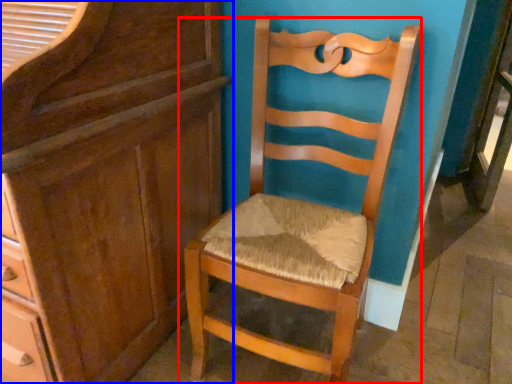
Question: Among these objects, which one is nearest to the camera, chair (highlighted by a red box) or cabinetry (highlighted by a blue box)?

Choices:
 (A) chair
 (B) cabinetry

Answer: (B)